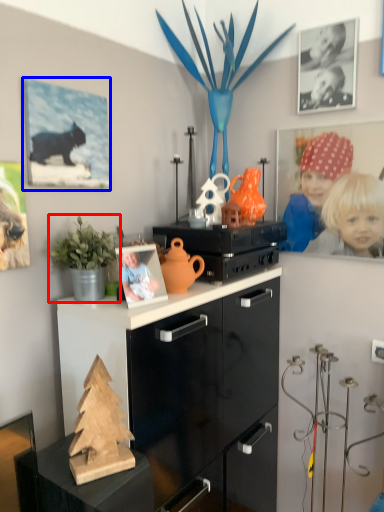
Question: Which point is further to the camera, houseplant (highlighted by a red box) or picture frame (highlighted by a blue box)?

Choices:
 (A) houseplant
 (B) picture frame

Answer: (B)